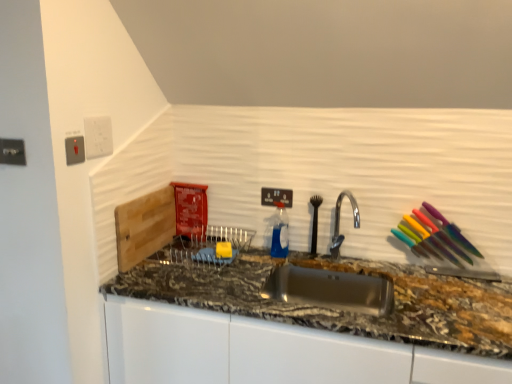
Question: Can granite at center be found inside black plastic electric outlet at upper center, arranged as the first electric outlet when viewed from the right?

Choices:
 (A) yes
 (B) no

Answer: (B)

Question: Can you confirm if black plastic electric outlet at upper center, which appears as the first electric outlet when viewed from the back, is positioned to the left of granite at center?

Choices:
 (A) no
 (B) yes

Answer: (B)

Question: Does black plastic electric outlet at upper center, arranged as the first electric outlet when viewed from the right, have a greater height compared to granite at center?

Choices:
 (A) yes
 (B) no

Answer: (B)

Question: Does black plastic electric outlet at upper center, positioned as the fourth electric outlet in left-to-right order, appear on the right side of granite at center?

Choices:
 (A) no
 (B) yes

Answer: (A)

Question: Can we say black plastic electric outlet at upper center, positioned as the fourth electric outlet in left-to-right order, lies outside granite at center?

Choices:
 (A) yes
 (B) no

Answer: (A)

Question: Relative to black plastic electric outlet at upper center, arranged as the first electric outlet when viewed from the right, is granite at center in front or behind?

Choices:
 (A) front
 (B) behind

Answer: (A)

Question: From the image's perspective, is granite at center above or below black plastic electric outlet at upper center, arranged as the first electric outlet when viewed from the right?

Choices:
 (A) below
 (B) above

Answer: (A)

Question: Considering the positions of granite at center and black plastic electric outlet at upper center, which appears as the fourth electric outlet when viewed from the front, in the image, is granite at center bigger or smaller than black plastic electric outlet at upper center, which appears as the fourth electric outlet when viewed from the front,?

Choices:
 (A) small
 (B) big

Answer: (B)

Question: In terms of height, does granite at center look taller or shorter compared to black plastic electric outlet at upper center, arranged as the first electric outlet when viewed from the right?

Choices:
 (A) short
 (B) tall

Answer: (B)

Question: Looking at the image, does metallic silver outlet at upper left, the first electric outlet from the left, seem bigger or smaller compared to satin silver switch at upper left, the 2th electric outlet from the front?

Choices:
 (A) small
 (B) big

Answer: (B)

Question: Is metallic silver outlet at upper left, the fourth electric outlet positioned from the right, wider or thinner than satin silver switch at upper left, the 2th electric outlet from the front?

Choices:
 (A) thin
 (B) wide

Answer: (B)

Question: From their relative heights in the image, would you say metallic silver outlet at upper left, the first electric outlet positioned from the front, is taller or shorter than satin silver switch at upper left, the 2th electric outlet when ordered from left to right?

Choices:
 (A) tall
 (B) short

Answer: (B)

Question: From a real-world perspective, is metallic silver outlet at upper left, the first electric outlet positioned from the front, physically located above or below satin silver switch at upper left, the 2th electric outlet when ordered from left to right?

Choices:
 (A) below
 (B) above

Answer: (B)

Question: Considering the positions of satin silver switch at upper left, acting as the third electric outlet starting from the back, and white plastic electric outlet at upper left, marked as the 2th electric outlet in a back-to-front arrangement, in the image, is satin silver switch at upper left, acting as the third electric outlet starting from the back, wider or thinner than white plastic electric outlet at upper left, marked as the 2th electric outlet in a back-to-front arrangement,?

Choices:
 (A) thin
 (B) wide

Answer: (B)

Question: In terms of height, does satin silver switch at upper left, the 2th electric outlet when ordered from left to right, look taller or shorter compared to white plastic electric outlet at upper left, the 3th electric outlet when ordered from front to back?

Choices:
 (A) short
 (B) tall

Answer: (A)